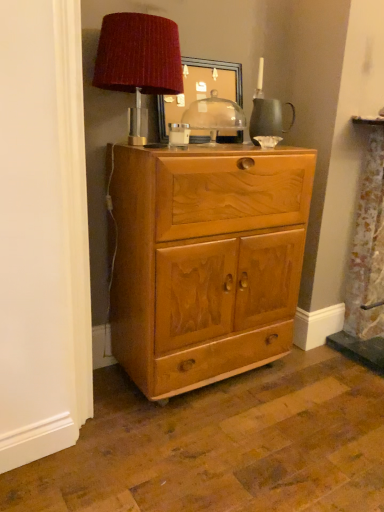
The width and height of the screenshot is (384, 512). What do you see at coordinates (205, 262) in the screenshot?
I see `light brown wood cabinet at center` at bounding box center [205, 262].

Find the location of a particular element. This screenshot has width=384, height=512. light brown wood cabinet at center is located at coordinates (205, 262).

Based on their sizes in the image, would you say velvet red lampshade at upper center is bigger or smaller than wooden picture frame at upper center?

Clearly, velvet red lampshade at upper center is larger in size than wooden picture frame at upper center.

How far apart are velvet red lampshade at upper center and wooden picture frame at upper center?

13.19 inches.

Does velvet red lampshade at upper center appear on the right side of wooden picture frame at upper center?

Incorrect, velvet red lampshade at upper center is not on the right side of wooden picture frame at upper center.

Which of these two, velvet red lampshade at upper center or wooden picture frame at upper center, stands taller?

velvet red lampshade at upper center is taller.

Does light brown wood cabinet at center appear on the left side of transparent glass dome at center?

Yes.

Considering the relative sizes of light brown wood cabinet at center and transparent glass dome at center in the image provided, is light brown wood cabinet at center taller than transparent glass dome at center?

Indeed, light brown wood cabinet at center has a greater height compared to transparent glass dome at center.

From a real-world perspective, is light brown wood cabinet at center on transparent glass dome at center?

Actually, light brown wood cabinet at center is physically below transparent glass dome at center in the real world.

Is wooden picture frame at upper center positioned before light brown wood cabinet at center?

No, wooden picture frame at upper center is further to the viewer.

From their relative heights in the image, would you say wooden picture frame at upper center is taller or shorter than light brown wood cabinet at center?

wooden picture frame at upper center is shorter than light brown wood cabinet at center.

Between wooden picture frame at upper center and light brown wood cabinet at center, which one has smaller size?

Smaller between the two is wooden picture frame at upper center.

Is velvet red lampshade at upper center smaller than light brown wood cabinet at center?

Indeed, velvet red lampshade at upper center has a smaller size compared to light brown wood cabinet at center.

In the scene shown: Between velvet red lampshade at upper center and light brown wood cabinet at center, which one has less height?

With less height is velvet red lampshade at upper center.

Does velvet red lampshade at upper center touch light brown wood cabinet at center?

No, velvet red lampshade at upper center is not touching light brown wood cabinet at center.

Considering the relative positions of velvet red lampshade at upper center and light brown wood cabinet at center in the image provided, is velvet red lampshade at upper center to the left of light brown wood cabinet at center from the viewer's perspective?

Indeed, velvet red lampshade at upper center is positioned on the left side of light brown wood cabinet at center.

From the image's perspective, does velvet red lampshade at upper center appear lower than transparent glass dome at center?

No, from the image's perspective, velvet red lampshade at upper center is not below transparent glass dome at center.

Is velvet red lampshade at upper center oriented away from transparent glass dome at center?

No, velvet red lampshade at upper center is not facing away from transparent glass dome at center.

Considering the relative positions of velvet red lampshade at upper center and transparent glass dome at center in the image provided, is velvet red lampshade at upper center to the right of transparent glass dome at center from the viewer's perspective?

In fact, velvet red lampshade at upper center is to the left of transparent glass dome at center.

How many degrees apart are the facing directions of light brown wood cabinet at center and velvet red lampshade at upper center?

They differ by 0.452 degrees in their facing directions.

Does light brown wood cabinet at center have a lesser height compared to velvet red lampshade at upper center?

No, light brown wood cabinet at center is not shorter than velvet red lampshade at upper center.

From a real-world perspective, is light brown wood cabinet at center located higher than velvet red lampshade at upper center?

No, from a real-world perspective, light brown wood cabinet at center is not above velvet red lampshade at upper center.

From a real-world perspective, is transparent glass dome at center beneath light brown wood cabinet at center?

No, from a real-world perspective, transparent glass dome at center is not under light brown wood cabinet at center.

How many degrees apart are the facing directions of transparent glass dome at center and light brown wood cabinet at center?

The angle between the facing direction of transparent glass dome at center and the facing direction of light brown wood cabinet at center is 0.763 degrees.

Would you say transparent glass dome at center contains light brown wood cabinet at center?

Actually, light brown wood cabinet at center is outside transparent glass dome at center.

Who is smaller, transparent glass dome at center or light brown wood cabinet at center?

transparent glass dome at center is smaller.

This screenshot has width=384, height=512. I want to click on picture frame that is under the velvet red lampshade at upper center (from a real-world perspective), so click(x=200, y=89).

Identify the location of table behind the light brown wood cabinet at center. (216, 119).

Looking at the image, which one is located further to wooden picture frame at upper center, transparent glass dome at center or velvet red lampshade at upper center?

velvet red lampshade at upper center is positioned further to the anchor wooden picture frame at upper center.

When comparing their distances from velvet red lampshade at upper center, does transparent glass dome at center or light brown wood cabinet at center seem further?

light brown wood cabinet at center is further to velvet red lampshade at upper center.

Which object lies nearer to the anchor point light brown wood cabinet at center, velvet red lampshade at upper center or wooden picture frame at upper center?

velvet red lampshade at upper center.

When comparing their distances from transparent glass dome at center, does light brown wood cabinet at center or velvet red lampshade at upper center seem further?

light brown wood cabinet at center is further to transparent glass dome at center.

Which object lies nearer to the anchor point wooden picture frame at upper center, transparent glass dome at center or light brown wood cabinet at center?

Among the two, transparent glass dome at center is located nearer to wooden picture frame at upper center.

From the image, which object appears to be nearer to transparent glass dome at center, velvet red lampshade at upper center or light brown wood cabinet at center?

velvet red lampshade at upper center is positioned closer to the anchor transparent glass dome at center.

Looking at the image, which one is located further to light brown wood cabinet at center, wooden picture frame at upper center or velvet red lampshade at upper center?

Based on the image, wooden picture frame at upper center appears to be further to light brown wood cabinet at center.

Looking at the image, which one is located further to velvet red lampshade at upper center, light brown wood cabinet at center or transparent glass dome at center?

The object further to velvet red lampshade at upper center is light brown wood cabinet at center.

This screenshot has width=384, height=512. Find the location of `table between velvet red lampshade at upper center and light brown wood cabinet at center in the vertical direction`. table between velvet red lampshade at upper center and light brown wood cabinet at center in the vertical direction is located at coordinates tap(216, 119).

Where is `table between velvet red lampshade at upper center and wooden picture frame at upper center in the front-back direction`? table between velvet red lampshade at upper center and wooden picture frame at upper center in the front-back direction is located at coordinates (216, 119).

The width and height of the screenshot is (384, 512). Find the location of `table lamp between wooden picture frame at upper center and light brown wood cabinet at center in the vertical direction`. table lamp between wooden picture frame at upper center and light brown wood cabinet at center in the vertical direction is located at coordinates (138, 62).

Locate an element on the screen. table between wooden picture frame at upper center and light brown wood cabinet at center in the vertical direction is located at coordinates (216, 119).